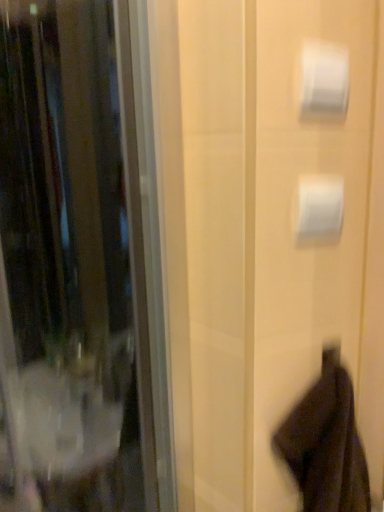
Question: Is white matte toilet paper at upper right, the second toilet paper viewed from the top, taller than dark brown fabric robe at lower right?

Choices:
 (A) yes
 (B) no

Answer: (B)

Question: Could you tell me if white matte toilet paper at upper right, the second toilet paper viewed from the top, is facing dark brown fabric robe at lower right?

Choices:
 (A) no
 (B) yes

Answer: (A)

Question: Is white matte toilet paper at upper right, marked as the 1th toilet paper in a bottom-to-top arrangement, to the right of dark brown fabric robe at lower right from the viewer's perspective?

Choices:
 (A) no
 (B) yes

Answer: (A)

Question: Is white matte toilet paper at upper right, marked as the 1th toilet paper in a bottom-to-top arrangement, to the left of dark brown fabric robe at lower right from the viewer's perspective?

Choices:
 (A) yes
 (B) no

Answer: (A)

Question: Are white matte toilet paper at upper right, marked as the 1th toilet paper in a bottom-to-top arrangement, and dark brown fabric robe at lower right making contact?

Choices:
 (A) yes
 (B) no

Answer: (B)

Question: From a real-world perspective, is white matte toilet paper at upper right, marked as the 1th toilet paper in a bottom-to-top arrangement, positioned over dark brown fabric robe at lower right based on gravity?

Choices:
 (A) yes
 (B) no

Answer: (A)

Question: Can you confirm if white glossy toilet paper at upper right, the second toilet paper in the bottom-to-top sequence, is positioned to the left of white matte toilet paper at upper right, the second toilet paper viewed from the top?

Choices:
 (A) yes
 (B) no

Answer: (A)

Question: Does white glossy toilet paper at upper right, the second toilet paper in the bottom-to-top sequence, have a larger size compared to white matte toilet paper at upper right, marked as the 1th toilet paper in a bottom-to-top arrangement?

Choices:
 (A) no
 (B) yes

Answer: (A)

Question: Is white glossy toilet paper at upper right, which ranks as the 1th toilet paper in top-to-bottom order, positioned behind white matte toilet paper at upper right, the second toilet paper viewed from the top?

Choices:
 (A) no
 (B) yes

Answer: (A)

Question: Is the depth of white glossy toilet paper at upper right, the second toilet paper in the bottom-to-top sequence, less than that of white matte toilet paper at upper right, marked as the 1th toilet paper in a bottom-to-top arrangement?

Choices:
 (A) yes
 (B) no

Answer: (A)

Question: Is white glossy toilet paper at upper right, which ranks as the 1th toilet paper in top-to-bottom order, turned away from white matte toilet paper at upper right, marked as the 1th toilet paper in a bottom-to-top arrangement?

Choices:
 (A) no
 (B) yes

Answer: (A)

Question: Does white glossy toilet paper at upper right, which ranks as the 1th toilet paper in top-to-bottom order, contain white matte toilet paper at upper right, the second toilet paper viewed from the top?

Choices:
 (A) yes
 (B) no

Answer: (B)

Question: Considering the relative positions of white matte toilet paper at upper right, marked as the 1th toilet paper in a bottom-to-top arrangement, and white glossy toilet paper at upper right, the second toilet paper in the bottom-to-top sequence, in the image provided, is white matte toilet paper at upper right, marked as the 1th toilet paper in a bottom-to-top arrangement, behind white glossy toilet paper at upper right, the second toilet paper in the bottom-to-top sequence,?

Choices:
 (A) no
 (B) yes

Answer: (B)